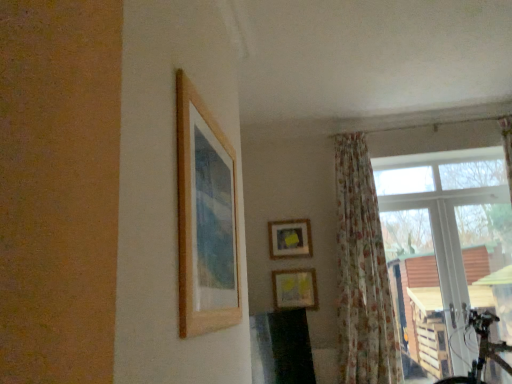
Where is `matte wooden picture frame at center, the 1th picture frame ordered from the bottom`? The height and width of the screenshot is (384, 512). matte wooden picture frame at center, the 1th picture frame ordered from the bottom is located at coordinates (295, 289).

At what (x,y) coordinates should I click in order to perform the action: click on transparent glass window at right. Please return your answer as a coordinate pair (x, y). Looking at the image, I should click on (449, 246).

This screenshot has height=384, width=512. Describe the element at coordinates (362, 273) in the screenshot. I see `floral fabric curtain at right` at that location.

Locate an element on the screen. wooden picture frame at upper left, the first picture frame in the front-to-back sequence is located at coordinates (205, 218).

In order to click on matte yellow picture frame at center, positioned as the 2th picture frame in top-to-bottom order in this screenshot , I will do `click(290, 238)`.

Identify the location of matte wooden picture frame at center, which is counted as the 2th picture frame, starting from the back. The image size is (512, 384). (295, 289).

Considering the positions of points (346, 335) and (282, 304), is point (346, 335) closer to camera compared to point (282, 304)?

Yes, it is.

Is floral fabric curtain at right completely or partially outside of matte wooden picture frame at center, positioned as the 2th picture frame in front-to-back order?

floral fabric curtain at right lies outside matte wooden picture frame at center, positioned as the 2th picture frame in front-to-back order,'s area.

Are floral fabric curtain at right and matte wooden picture frame at center, the 1th picture frame ordered from the bottom, located far from each other?

That's not correct — floral fabric curtain at right is a little close to matte wooden picture frame at center, the 1th picture frame ordered from the bottom.

From a real-world perspective, is matte yellow picture frame at center, which is counted as the 2th picture frame, starting from the bottom, below matte wooden picture frame at center, the 1th picture frame ordered from the bottom?

No, from a real-world perspective, matte yellow picture frame at center, which is counted as the 2th picture frame, starting from the bottom, is not under matte wooden picture frame at center, the 1th picture frame ordered from the bottom.

How much distance is there between matte yellow picture frame at center, which is counted as the 2th picture frame, starting from the bottom, and matte wooden picture frame at center, positioned as the 2th picture frame in front-to-back order?

A distance of 11.71 inches exists between matte yellow picture frame at center, which is counted as the 2th picture frame, starting from the bottom, and matte wooden picture frame at center, positioned as the 2th picture frame in front-to-back order.

Who is shorter, matte yellow picture frame at center, positioned as the 2th picture frame in top-to-bottom order, or matte wooden picture frame at center, which is counted as the third picture frame, starting from the top?

matte wooden picture frame at center, which is counted as the third picture frame, starting from the top, is shorter.

Is matte yellow picture frame at center, which is counted as the first picture frame, starting from the back, not near matte wooden picture frame at center, the 1th picture frame ordered from the bottom?

They are positioned close to each other.

How much distance is there between floral fabric curtain at right and matte yellow picture frame at center, the third picture frame in the front-to-back sequence?

A distance of 24.91 inches exists between floral fabric curtain at right and matte yellow picture frame at center, the third picture frame in the front-to-back sequence.

Is floral fabric curtain at right inside or outside of matte yellow picture frame at center, which is counted as the first picture frame, starting from the back?

floral fabric curtain at right exists outside the volume of matte yellow picture frame at center, which is counted as the first picture frame, starting from the back.

Is point (390, 306) closer to camera compared to point (290, 240)?

That is True.

Which of these two, floral fabric curtain at right or matte yellow picture frame at center, which is counted as the first picture frame, starting from the back, stands taller?

Standing taller between the two is floral fabric curtain at right.

From the image's perspective, which one is positioned lower, matte yellow picture frame at center, which is counted as the first picture frame, starting from the back, or wooden picture frame at upper left, positioned as the 3th picture frame in bottom-to-top order?

matte yellow picture frame at center, which is counted as the first picture frame, starting from the back, is shown below in the image.

In the scene shown: Is matte yellow picture frame at center, which is counted as the first picture frame, starting from the back, smaller than wooden picture frame at upper left, which is the 3th picture frame in back-to-front order?

Yes.

Which is farther from the camera, (302, 245) or (188, 248)?

Point (302, 245)

From a real-world perspective, is matte yellow picture frame at center, the third picture frame in the front-to-back sequence, physically below wooden picture frame at upper left, which is the 3th picture frame in back-to-front order?

No.

Do you think transparent glass window at right is within floral fabric curtain at right, or outside of it?

transparent glass window at right is spatially situated outside floral fabric curtain at right.

Is transparent glass window at right with floral fabric curtain at right?

No.

In terms of size, does transparent glass window at right appear bigger or smaller than floral fabric curtain at right?

transparent glass window at right is smaller than floral fabric curtain at right.

Which object is thinner, transparent glass window at right or floral fabric curtain at right?

transparent glass window at right.

What's the angular difference between wooden picture frame at upper left, positioned as the 3th picture frame in bottom-to-top order, and matte yellow picture frame at center, positioned as the 2th picture frame in top-to-bottom order,'s facing directions?

The angle between the facing direction of wooden picture frame at upper left, positioned as the 3th picture frame in bottom-to-top order, and the facing direction of matte yellow picture frame at center, positioned as the 2th picture frame in top-to-bottom order, is 89.3 degrees.

Is wooden picture frame at upper left, the first picture frame in the front-to-back sequence, completely or partially outside of matte yellow picture frame at center, positioned as the 2th picture frame in top-to-bottom order?

wooden picture frame at upper left, the first picture frame in the front-to-back sequence, lies outside matte yellow picture frame at center, positioned as the 2th picture frame in top-to-bottom order,'s area.

Which of these two, wooden picture frame at upper left, which is the 3th picture frame in back-to-front order, or matte yellow picture frame at center, the third picture frame in the front-to-back sequence, stands taller?

With more height is wooden picture frame at upper left, which is the 3th picture frame in back-to-front order.

From the image's perspective, which is above, wooden picture frame at upper left, placed as the first picture frame when sorted from top to bottom, or matte yellow picture frame at center, which is counted as the first picture frame, starting from the back?

wooden picture frame at upper left, placed as the first picture frame when sorted from top to bottom.

Between matte wooden picture frame at center, the 1th picture frame ordered from the bottom, and matte yellow picture frame at center, which is counted as the 2th picture frame, starting from the bottom, which one has less height?

With less height is matte wooden picture frame at center, the 1th picture frame ordered from the bottom.

This screenshot has height=384, width=512. Identify the location of picture frame below the matte yellow picture frame at center, which is counted as the first picture frame, starting from the back (from the image's perspective). (295, 289).

Which of these two, matte wooden picture frame at center, positioned as the 2th picture frame in front-to-back order, or matte yellow picture frame at center, which is counted as the first picture frame, starting from the back, is smaller?

matte yellow picture frame at center, which is counted as the first picture frame, starting from the back.

Which object is wider, matte wooden picture frame at center, the 1th picture frame ordered from the bottom, or matte yellow picture frame at center, the third picture frame in the front-to-back sequence?

With larger width is matte wooden picture frame at center, the 1th picture frame ordered from the bottom.

Where is `the 2nd picture frame located beneath the floral fabric curtain at right (from a real-world perspective)`? This screenshot has width=512, height=384. the 2nd picture frame located beneath the floral fabric curtain at right (from a real-world perspective) is located at coordinates (295, 289).

Locate an element on the screen. The height and width of the screenshot is (384, 512). the 1st picture frame positioned above the matte wooden picture frame at center, the 1th picture frame ordered from the bottom (from the image's perspective) is located at coordinates (290, 238).

Based on the photo, from the image, which object appears to be farther from matte wooden picture frame at center, the 1th picture frame ordered from the bottom, floral fabric curtain at right or transparent glass window at right?

Based on the image, transparent glass window at right appears to be further to matte wooden picture frame at center, the 1th picture frame ordered from the bottom.

Which object lies nearer to the anchor point wooden picture frame at upper left, the first picture frame in the front-to-back sequence, transparent glass window at right or floral fabric curtain at right?

floral fabric curtain at right.

From the image, which object appears to be nearer to wooden picture frame at upper left, positioned as the 3th picture frame in bottom-to-top order, floral fabric curtain at right or matte wooden picture frame at center, which is counted as the third picture frame, starting from the top?

floral fabric curtain at right lies closer to wooden picture frame at upper left, positioned as the 3th picture frame in bottom-to-top order, than the other object.

Looking at the image, which one is located closer to matte wooden picture frame at center, the 1th picture frame ordered from the bottom, matte yellow picture frame at center, positioned as the 2th picture frame in top-to-bottom order, or floral fabric curtain at right?

Among the two, matte yellow picture frame at center, positioned as the 2th picture frame in top-to-bottom order, is located nearer to matte wooden picture frame at center, the 1th picture frame ordered from the bottom.

Based on the photo, estimate the real-world distances between objects in this image. Which object is further from matte yellow picture frame at center, positioned as the 2th picture frame in top-to-bottom order, wooden picture frame at upper left, which is the 3th picture frame in back-to-front order, or matte wooden picture frame at center, which is counted as the third picture frame, starting from the top?

wooden picture frame at upper left, which is the 3th picture frame in back-to-front order, is further to matte yellow picture frame at center, positioned as the 2th picture frame in top-to-bottom order.

Which object lies nearer to the anchor point matte wooden picture frame at center, which is counted as the 2th picture frame, starting from the back, transparent glass window at right or floral fabric curtain at right?

The object closer to matte wooden picture frame at center, which is counted as the 2th picture frame, starting from the back, is floral fabric curtain at right.

Which object lies nearer to the anchor point matte yellow picture frame at center, which is counted as the 2th picture frame, starting from the bottom, floral fabric curtain at right or transparent glass window at right?

floral fabric curtain at right.

Considering their positions, is matte wooden picture frame at center, which is counted as the third picture frame, starting from the top, positioned further to wooden picture frame at upper left, which is the 3th picture frame in back-to-front order, than floral fabric curtain at right?

matte wooden picture frame at center, which is counted as the third picture frame, starting from the top.

Find the location of a particular element. picture frame positioned between wooden picture frame at upper left, the first picture frame in the front-to-back sequence, and matte yellow picture frame at center, the third picture frame in the front-to-back sequence, from near to far is located at coordinates (295, 289).

Where is `curtain between wooden picture frame at upper left, the first picture frame in the front-to-back sequence, and transparent glass window at right from front to back`? This screenshot has height=384, width=512. curtain between wooden picture frame at upper left, the first picture frame in the front-to-back sequence, and transparent glass window at right from front to back is located at coordinates (362, 273).

I want to click on curtain between matte wooden picture frame at center, the 1th picture frame ordered from the bottom, and transparent glass window at right from left to right, so [x=362, y=273].

What are the coordinates of `picture frame between floral fabric curtain at right and matte yellow picture frame at center, which is counted as the first picture frame, starting from the back, in the front-back direction` in the screenshot? It's located at (295, 289).